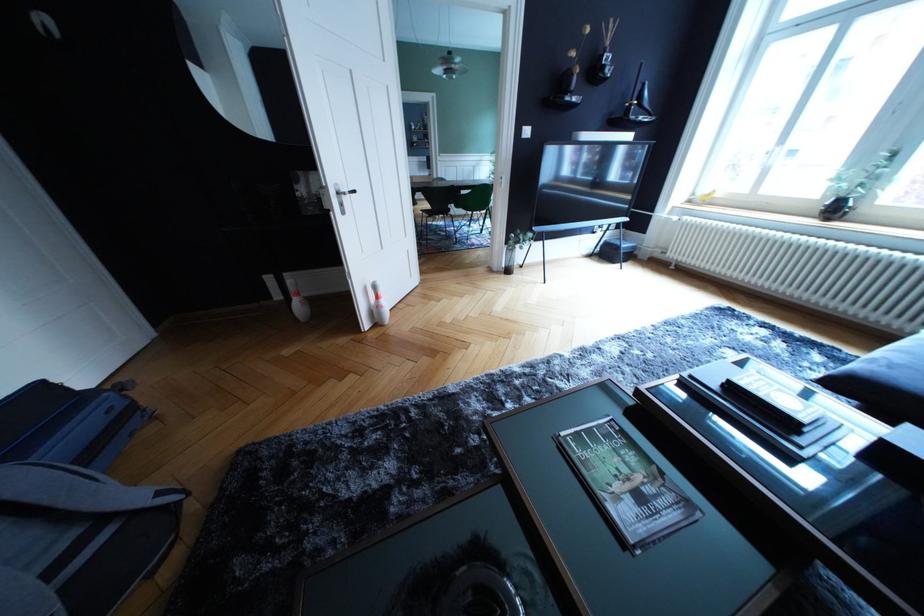
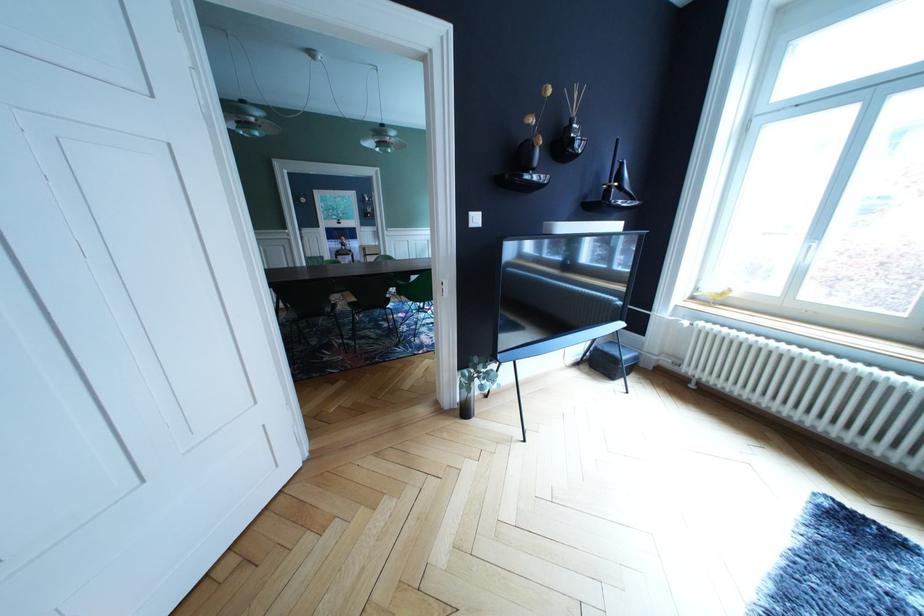
In the second image, find the point that corresponds to (x=569, y=90) in the first image.

(529, 164)